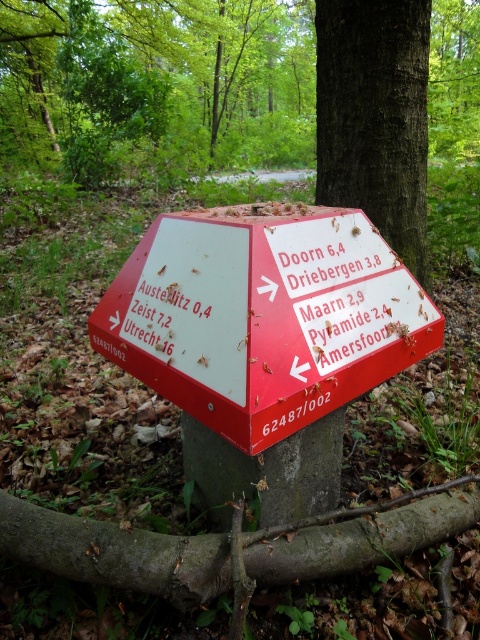
You are standing in a forest and see the red plastic sign at center and the dark brown bark at upper center. Which object is taller?

The dark brown bark at upper center is taller than the red plastic sign at center.

You are a hiker who just arrived at this signpost and want to know if you can safely place your backpack between the red plastic sign at center and the dark brown bark at upper center without it getting in the way of the sign. The backpack measures 1.5 feet in width. Can you fit it there?

The distance between the red plastic sign at center and the dark brown bark at upper center is 5.32 feet. Since the backpack is only 1.5 feet wide, it should fit comfortably between them without obstructing the sign.

Looking at this image, you are a hiker who needs to determine the distance between the red plastic sign at center and the dark brown bark at upper center. Which object is larger in size?

The red plastic sign at center is smaller than the dark brown bark at upper center according to the description provided.